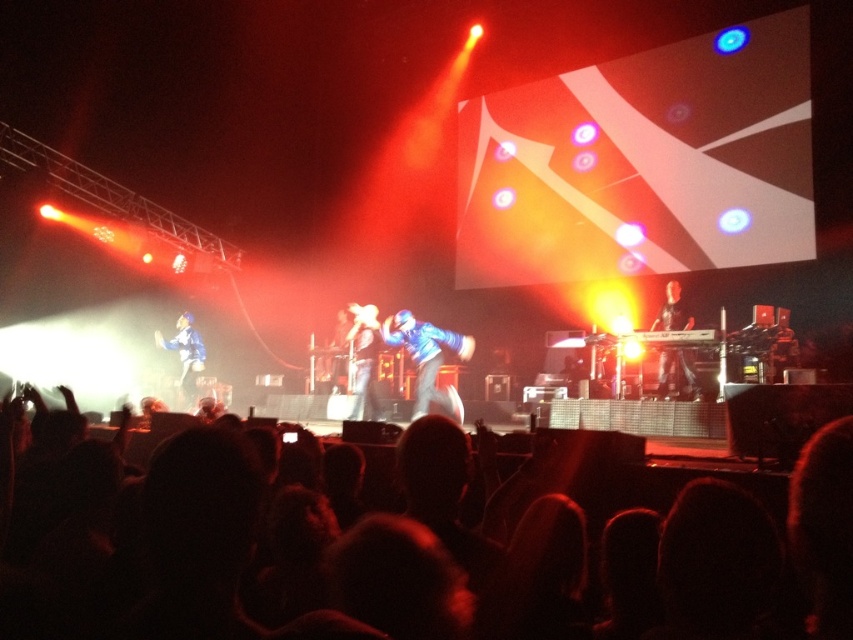
Consider the image. Who is higher up, black hair at lower center or blue denim jeans at center?

black hair at lower center is above.

Which is more to the left, black hair at lower center or blue denim jeans at center?

black hair at lower center is more to the left.

Between point (358, 636) and point (428, 401), which one is positioned behind?

Point (428, 401)

Locate an element on the screen. black hair at lower center is located at coordinates (358, 570).

Between shiny black jacket at center and blue fabric jacket at left, which one appears on the left side from the viewer's perspective?

From the viewer's perspective, blue fabric jacket at left appears more on the left side.

Where is `shiny black jacket at center`? shiny black jacket at center is located at coordinates (676, 374).

Does blue denim jeans at center appear over metallic blue suit at center?

No, blue denim jeans at center is not above metallic blue suit at center.

What do you see at coordinates (428, 358) in the screenshot? This screenshot has width=853, height=640. I see `blue denim jeans at center` at bounding box center [428, 358].

At what (x,y) coordinates should I click in order to perform the action: click on blue denim jeans at center. Please return your answer as a coordinate pair (x, y). This screenshot has width=853, height=640. Looking at the image, I should click on (428, 358).